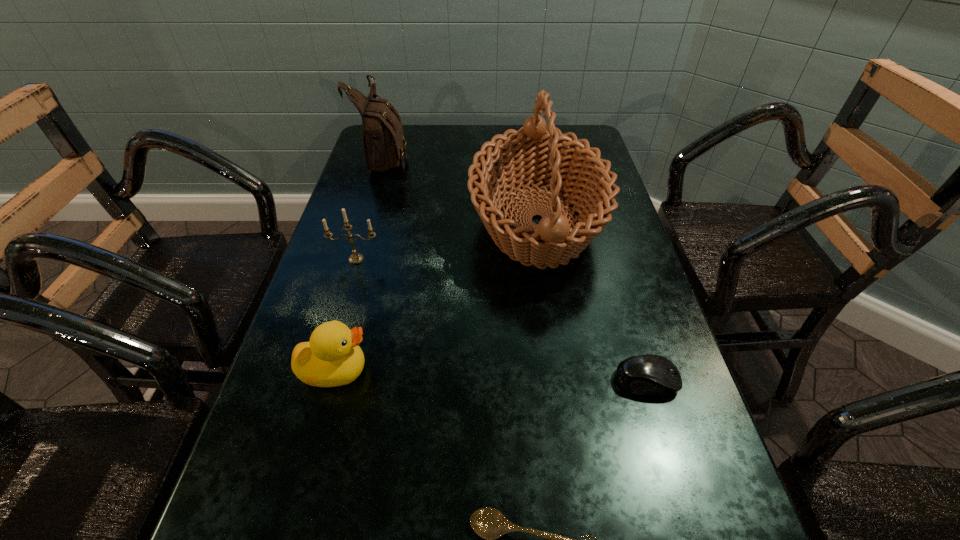
Find the location of `free spot at the far left corner of the desktop`. free spot at the far left corner of the desktop is located at coordinates (405, 140).

What are the coordinates of `vacant space that is in between the duck and the candle` in the screenshot? It's located at (346, 315).

The image size is (960, 540). What are the coordinates of `empty location between the basket and the shoulder bag` in the screenshot? It's located at (461, 190).

The image size is (960, 540). I want to click on unoccupied position between the fifth tallest object and the candle, so click(x=501, y=320).

Find the location of a particular element. This screenshot has width=960, height=540. blank region between the basket and the fifth tallest object is located at coordinates [592, 301].

Locate an element on the screen. Image resolution: width=960 pixels, height=540 pixels. vacant area between the duck and the basket is located at coordinates (436, 296).

I want to click on free spot between the candle and the fourth tallest object, so click(346, 315).

This screenshot has width=960, height=540. Identify the location of vacant point located between the fifth tallest object and the tallest object. (592, 301).

Find the location of a particular element. This screenshot has height=540, width=960. free point between the basket and the shoulder bag is located at coordinates (461, 190).

The image size is (960, 540). Find the location of `blank region between the candle and the fifth tallest object`. blank region between the candle and the fifth tallest object is located at coordinates (501, 320).